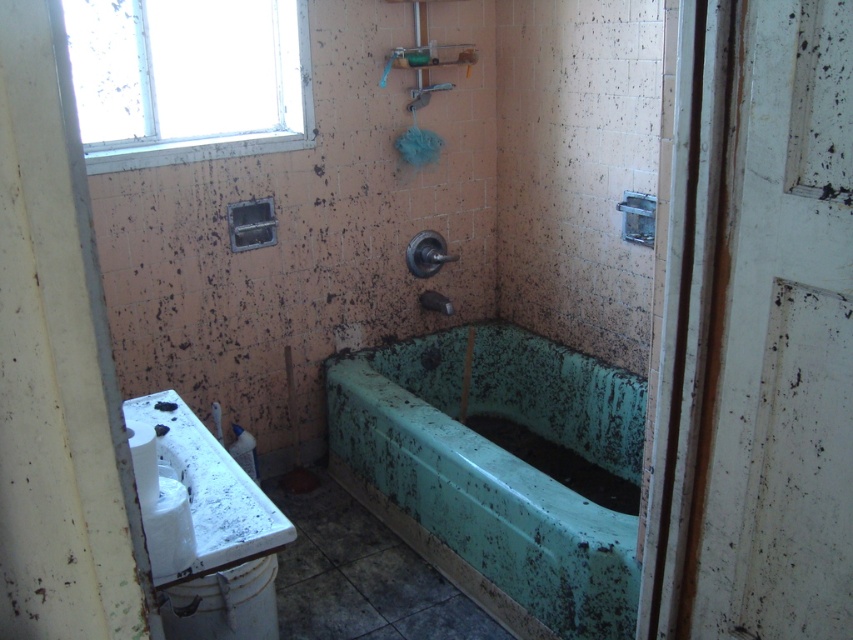
You are standing in the bathroom and want to open the white plastic window at upper left to let in some fresh air. However, you need to reach it from the white glossy toilet bowl at lower left. Which direction should you move relative to the toilet bowl to reach the window?

The white plastic window at upper left is located to the left of the white glossy toilet bowl at lower left. Therefore, you should move to your left relative to the toilet bowl to reach the window.

You are standing in the dilapidated bathroom and want to clean the white plastic window at upper left and the white glossy toilet bowl at lower left. Which object is farther from you, the observer?

The white glossy toilet bowl at lower left is behind the white plastic window at upper left, so it is farther away from you.